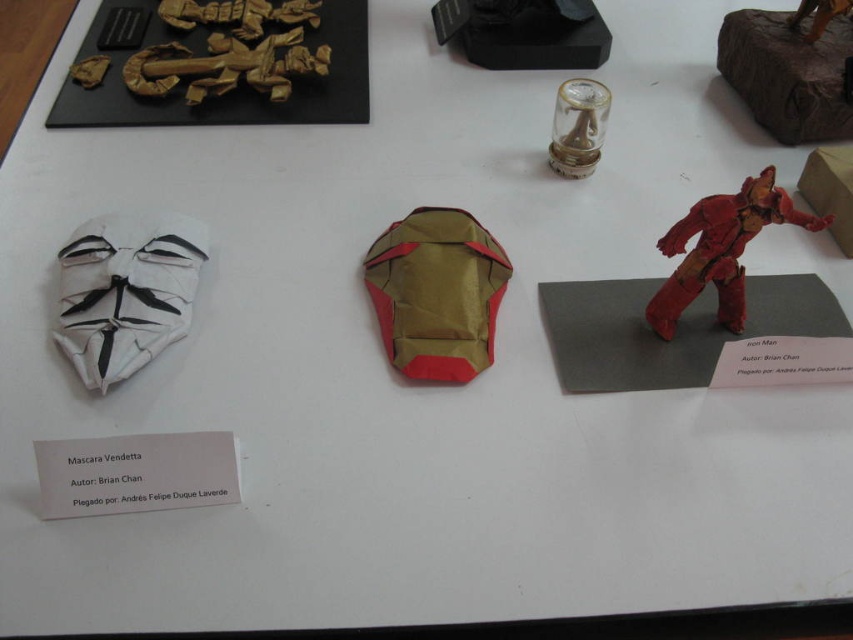
Looking at this image, you are an art curator arranging an exhibition. You need to place a new item between the gold paper mask at center and the black matte figurine at upper center. Where should you position it to maintain the vertical arrangement?

The gold paper mask at center is located below the black matte figurine at upper center, so to maintain the vertical arrangement, place the new item either between them vertically or adjust their positions to keep the vertical hierarchy.

Where is the gold paper mask at center located on the table?

The gold paper mask at center is located at point 0.459 on the x axis and 0.512 on the y axis.